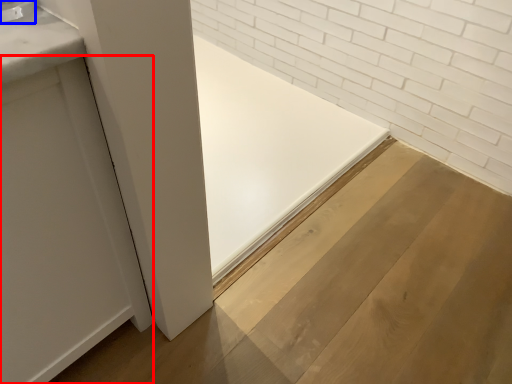
Question: Which object appears closest to the camera in this image, door (highlighted by a red box) or faucet (highlighted by a blue box)?

Choices:
 (A) door
 (B) faucet

Answer: (A)